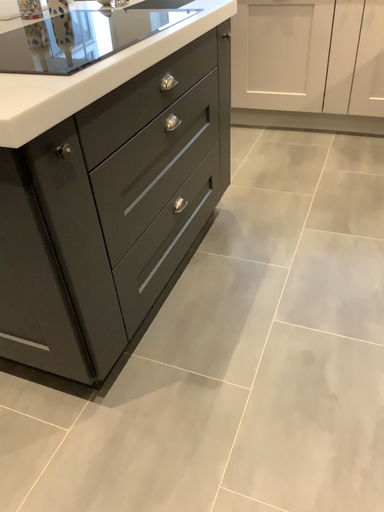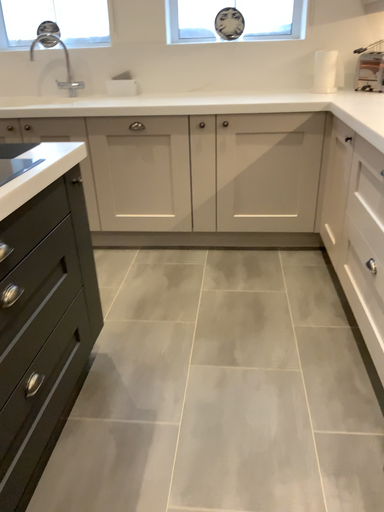
Question: How did the camera likely rotate when shooting the video?

Choices:
 (A) rotated downward
 (B) rotated upward

Answer: (B)